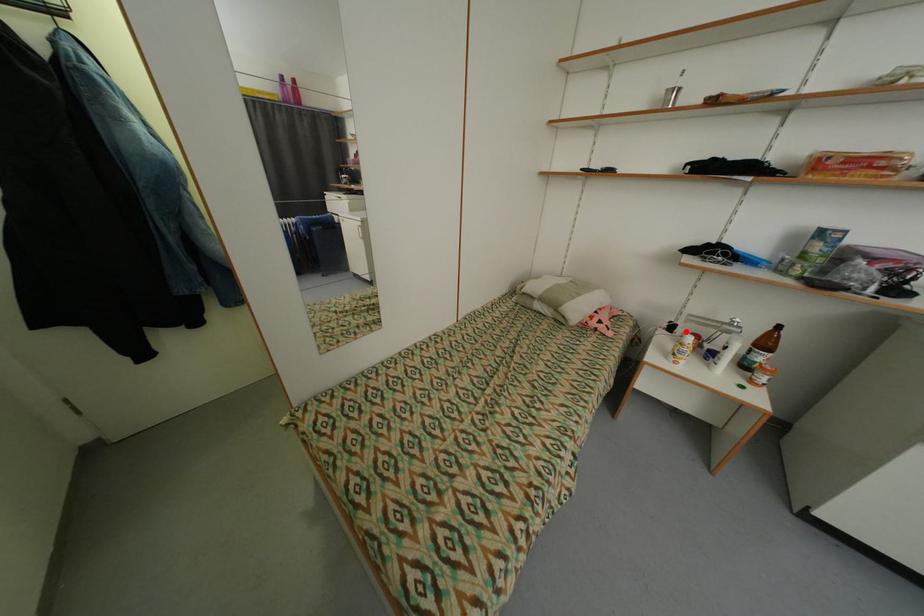
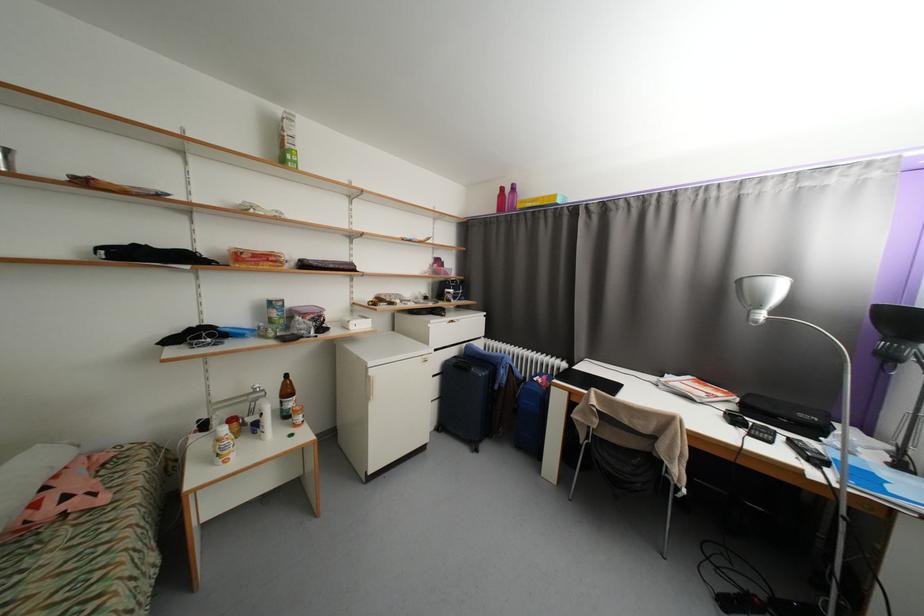
Locate, in the second image, the point that corresponds to the highlighted location in the first image.

(222, 424)